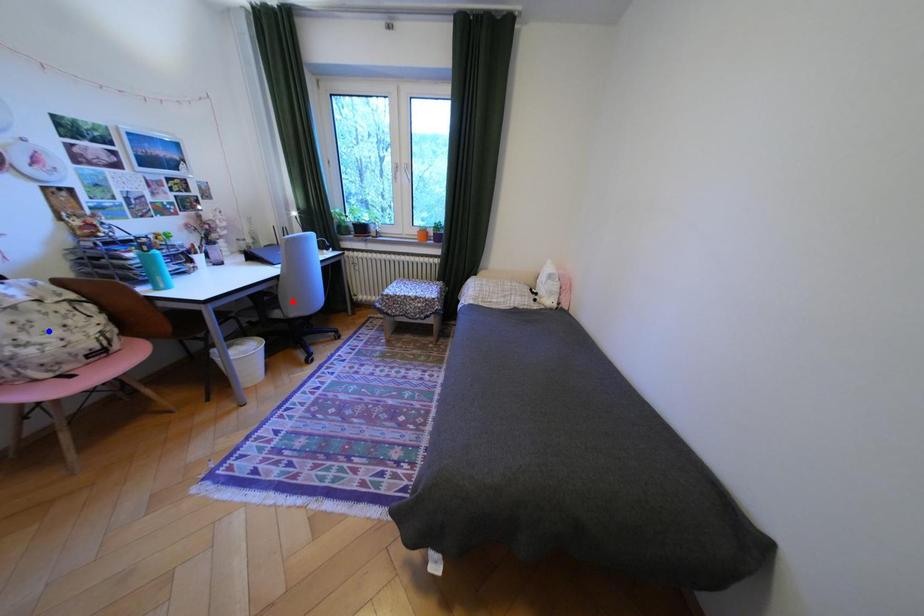
Question: Two points are marked on the image. Which point is closer to the camera?

Choices:
 (A) Blue point is closer.
 (B) Red point is closer.

Answer: (A)